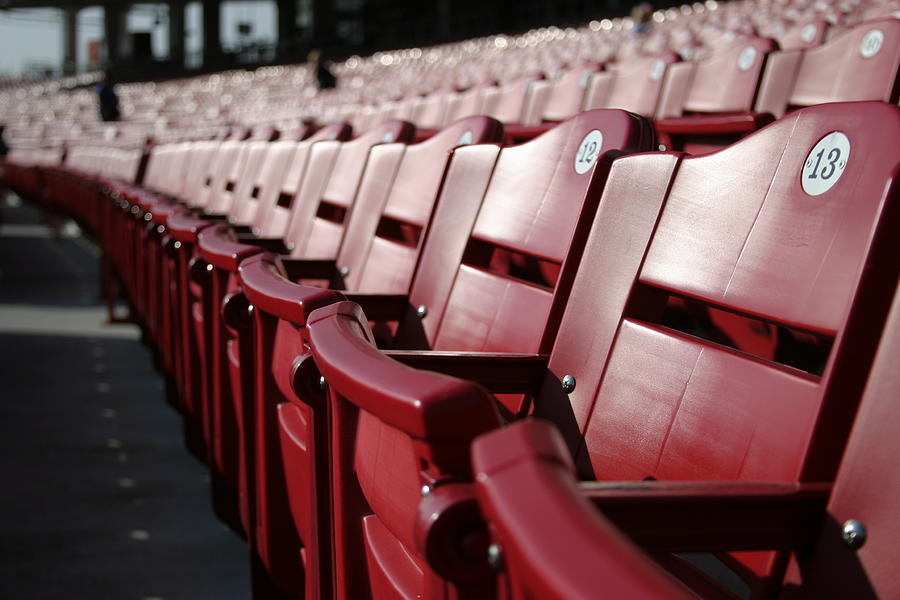
Identify the location of windows. This screenshot has height=600, width=900. (264, 28), (198, 35), (150, 34), (99, 44), (38, 45).